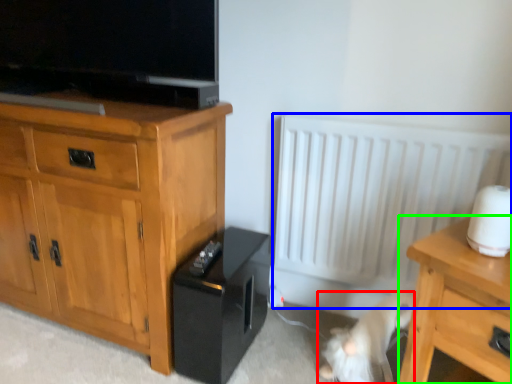
Question: Considering the real-world distances, which object is closest to animal (highlighted by a red box)? radiator (highlighted by a blue box) or nightstand (highlighted by a green box).

Choices:
 (A) radiator
 (B) nightstand

Answer: (B)